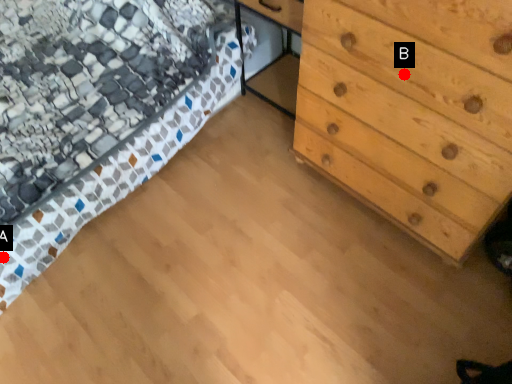
Question: Two points are circled on the image, labeled by A and B beside each circle. Which point is farther to the camera?

Choices:
 (A) A is further
 (B) B is further

Answer: (A)